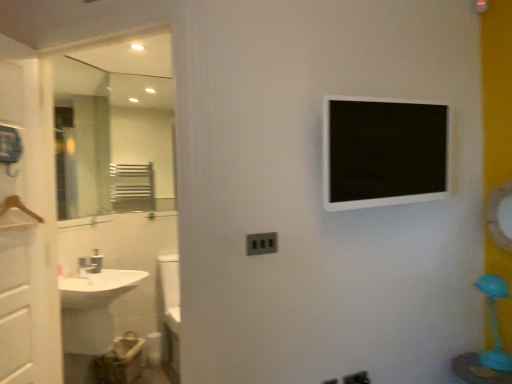
Question: Is white glossy screen door at left bigger than matte gray electric outlet at center?

Choices:
 (A) yes
 (B) no

Answer: (A)

Question: From the image's perspective, is white glossy screen door at left under matte gray electric outlet at center?

Choices:
 (A) no
 (B) yes

Answer: (A)

Question: Is white glossy screen door at left facing towards matte gray electric outlet at center?

Choices:
 (A) no
 (B) yes

Answer: (B)

Question: From the image's perspective, is white glossy screen door at left on top of matte gray electric outlet at center?

Choices:
 (A) no
 (B) yes

Answer: (B)

Question: Is the surface of white glossy screen door at left in direct contact with matte gray electric outlet at center?

Choices:
 (A) no
 (B) yes

Answer: (A)

Question: Considering the relative sizes of white glossy screen door at left and matte gray electric outlet at center in the image provided, is white glossy screen door at left thinner than matte gray electric outlet at center?

Choices:
 (A) no
 (B) yes

Answer: (A)

Question: Is matte gray electric outlet at center to the right of glossy metallic mirror at upper right from the viewer's perspective?

Choices:
 (A) no
 (B) yes

Answer: (A)

Question: Is matte gray electric outlet at center far away from glossy metallic mirror at upper right?

Choices:
 (A) no
 (B) yes

Answer: (B)

Question: Are matte gray electric outlet at center and glossy metallic mirror at upper right beside each other?

Choices:
 (A) no
 (B) yes

Answer: (A)

Question: Can you confirm if matte gray electric outlet at center is shorter than glossy metallic mirror at upper right?

Choices:
 (A) no
 (B) yes

Answer: (B)

Question: Does matte gray electric outlet at center have a larger size compared to glossy metallic mirror at upper right?

Choices:
 (A) yes
 (B) no

Answer: (B)

Question: Is matte gray electric outlet at center outside of glossy metallic mirror at upper right?

Choices:
 (A) yes
 (B) no

Answer: (A)

Question: Can you confirm if white glossy sink at lower left is smaller than white glossy medicine cabinet at upper center?

Choices:
 (A) no
 (B) yes

Answer: (A)